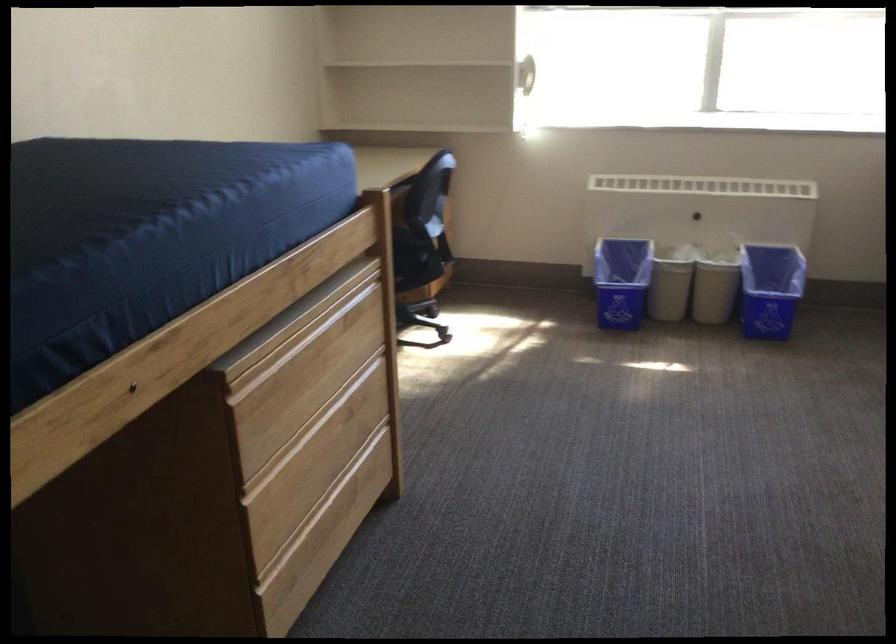
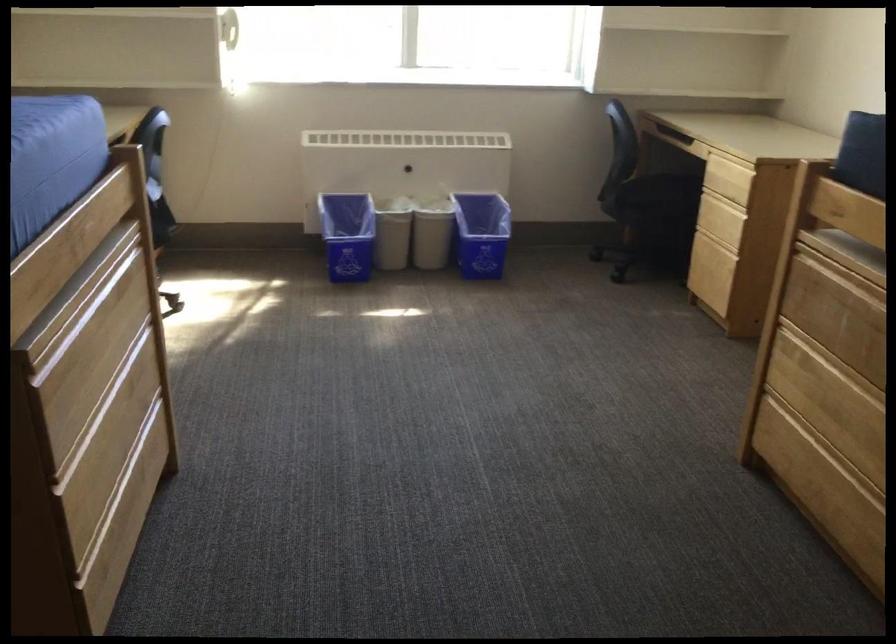
Question: The first image is from the beginning of the video and the second image is from the end. How did the camera likely rotate when shooting the video?

Choices:
 (A) Left
 (B) Right
 (C) Up
 (D) Down

Answer: (B)